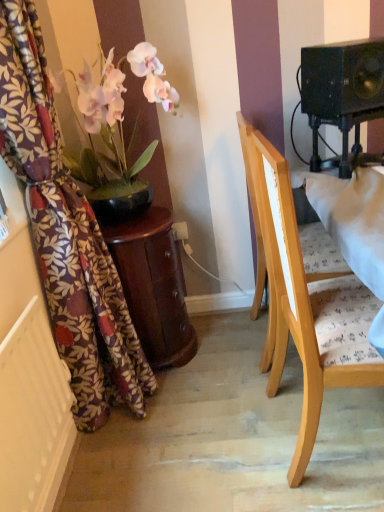
Image resolution: width=384 pixels, height=512 pixels. What do you see at coordinates (304, 298) in the screenshot?
I see `light wood chair at center` at bounding box center [304, 298].

Locate an element on the screen. The width and height of the screenshot is (384, 512). mahogany wood side table at left is located at coordinates (153, 286).

In order to click on matte pink orchid at left in this screenshot , I will do `click(119, 111)`.

Find the location of a particular element. The width and height of the screenshot is (384, 512). light wood chair at center is located at coordinates (304, 298).

Which object is closer to the camera taking this photo, matte pink orchid at left or mahogany wood side table at left?

Positioned in front is matte pink orchid at left.

Is matte pink orchid at left taller or shorter than mahogany wood side table at left?

Considering their sizes, matte pink orchid at left has more height than mahogany wood side table at left.

Measure the distance between matte pink orchid at left and mahogany wood side table at left.

matte pink orchid at left and mahogany wood side table at left are 16.28 inches apart.

Does matte pink orchid at left turn towards mahogany wood side table at left?

No, matte pink orchid at left is not facing towards mahogany wood side table at left.

How different are the orientations of light wood chair at center and black matte speaker at upper right in degrees?

The angular difference between light wood chair at center and black matte speaker at upper right is 65.6 degrees.

Could you tell me if light wood chair at center is turned towards black matte speaker at upper right?

No.

Is light wood chair at center thinner than black matte speaker at upper right?

Incorrect, the width of light wood chair at center is not less than that of black matte speaker at upper right.

Does light wood chair at center have a greater height compared to black matte speaker at upper right?

Correct, light wood chair at center is much taller as black matte speaker at upper right.

Could you tell me if mahogany wood side table at left is facing light wood chair at center?

No, mahogany wood side table at left is not turned towards light wood chair at center.

Based on the photo, between mahogany wood side table at left and light wood chair at center, which one has larger size?

Bigger between the two is light wood chair at center.

Are mahogany wood side table at left and light wood chair at center making contact?

No, mahogany wood side table at left is not touching light wood chair at center.

Can you confirm if mahogany wood side table at left is positioned to the right of light wood chair at center?

No, mahogany wood side table at left is not to the right of light wood chair at center.

Considering the positions of point (164, 306) and point (107, 327), is point (164, 306) closer or farther from the camera than point (107, 327)?

Clearly, point (164, 306) is more distant from the camera than point (107, 327).

Which is correct: mahogany wood side table at left is inside floral fabric curtain at left, or outside of it?

mahogany wood side table at left is located beyond the bounds of floral fabric curtain at left.

Considering the relative sizes of mahogany wood side table at left and floral fabric curtain at left in the image provided, is mahogany wood side table at left wider than floral fabric curtain at left?

Indeed, mahogany wood side table at left has a greater width compared to floral fabric curtain at left.

Is mahogany wood side table at left directly adjacent to floral fabric curtain at left?

There is a gap between mahogany wood side table at left and floral fabric curtain at left.

From a real-world perspective, which is physically above, black matte speaker at upper right or light wood chair at center?

From a 3D spatial view, black matte speaker at upper right is above.

Is light wood chair at center surrounded by black matte speaker at upper right?

Definitely not — light wood chair at center is not inside black matte speaker at upper right.

Does black matte speaker at upper right appear on the right side of light wood chair at center?

Correct, you'll find black matte speaker at upper right to the right of light wood chair at center.

In the image, is matte pink orchid at left on the left side or the right side of black matte speaker at upper right?

From the image, it's evident that matte pink orchid at left is to the left of black matte speaker at upper right.

From a real-world perspective, which is physically below, matte pink orchid at left or black matte speaker at upper right?

From a 3D spatial view, black matte speaker at upper right is below.

How much distance is there between matte pink orchid at left and black matte speaker at upper right?

They are 26.69 inches apart.

From the picture: Is matte pink orchid at left bigger or smaller than black matte speaker at upper right?

Considering their sizes, matte pink orchid at left takes up more space than black matte speaker at upper right.

From the image's perspective, which object appears higher, floral fabric curtain at left or black matte speaker at upper right?

black matte speaker at upper right appears higher in the image.

In the scene shown: Considering the positions of objects floral fabric curtain at left and black matte speaker at upper right in the image provided, who is more to the right, floral fabric curtain at left or black matte speaker at upper right?

From the viewer's perspective, black matte speaker at upper right appears more on the right side.

Between floral fabric curtain at left and black matte speaker at upper right, which one has smaller size?

black matte speaker at upper right.

Is floral fabric curtain at left beside black matte speaker at upper right?

floral fabric curtain at left is not next to black matte speaker at upper right, and they're not touching.

The height and width of the screenshot is (512, 384). In order to click on table on the right of matte pink orchid at left in this screenshot , I will do `click(153, 286)`.

Image resolution: width=384 pixels, height=512 pixels. Identify the location of chair that appears in front of the black matte speaker at upper right. (304, 298).

Which object lies further to the anchor point white textured radiator at lower left, matte pink orchid at left or black matte speaker at upper right?

Among the two, black matte speaker at upper right is located further to white textured radiator at lower left.

Looking at this image, estimate the real-world distances between objects in this image. Which object is further from black matte speaker at upper right, floral fabric curtain at left or white textured radiator at lower left?

white textured radiator at lower left lies further to black matte speaker at upper right than the other object.

Looking at the image, which one is located closer to white textured radiator at lower left, black matte speaker at upper right or mahogany wood side table at left?

mahogany wood side table at left.

Based on their spatial positions, is matte pink orchid at left or mahogany wood side table at left further from black matte speaker at upper right?

Based on the image, mahogany wood side table at left appears to be further to black matte speaker at upper right.

Which object lies nearer to the anchor point white textured radiator at lower left, light wood chair at center or floral fabric curtain at left?

floral fabric curtain at left lies closer to white textured radiator at lower left than the other object.

When comparing their distances from mahogany wood side table at left, does floral fabric curtain at left or white textured radiator at lower left seem closer?

The object closer to mahogany wood side table at left is floral fabric curtain at left.

When comparing their distances from light wood chair at center, does matte pink orchid at left or black matte speaker at upper right seem further?

The object further to light wood chair at center is matte pink orchid at left.

When comparing their distances from light wood chair at center, does black matte speaker at upper right or matte pink orchid at left seem further?

Among the two, matte pink orchid at left is located further to light wood chair at center.

The width and height of the screenshot is (384, 512). Find the location of `houseplant between floral fabric curtain at left and light wood chair at center in the horizontal direction`. houseplant between floral fabric curtain at left and light wood chair at center in the horizontal direction is located at coordinates (119, 111).

Locate an element on the screen. This screenshot has width=384, height=512. table between matte pink orchid at left and white textured radiator at lower left from top to bottom is located at coordinates (153, 286).

Identify the location of houseplant between floral fabric curtain at left and black matte speaker at upper right from left to right. (119, 111).

You are a GUI agent. You are given a task and a screenshot of the screen. Output one action in this format:
    pyautogui.click(x=<x>, y=<y>)
    Task: Click on the houseplant between floral fabric curtain at left and mahogany wood side table at left in the front-back direction
    The height and width of the screenshot is (512, 384).
    Given the screenshot: What is the action you would take?
    pyautogui.click(x=119, y=111)